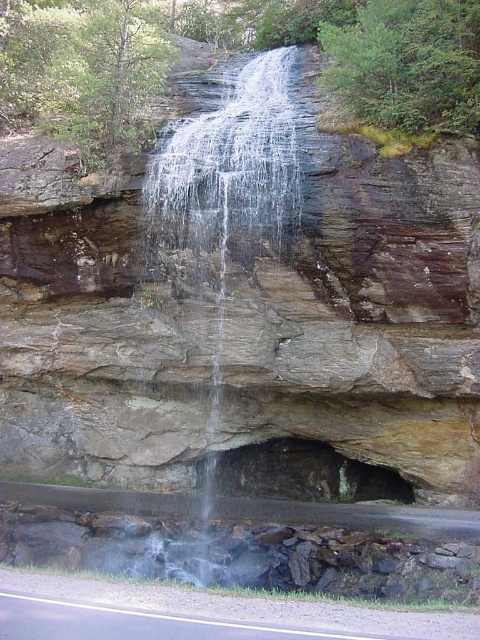
Is point (62, 449) closer to camera compared to point (181, 552)?

No.

Does brown rough rock face at center have a larger size compared to clear water at center?

Correct, brown rough rock face at center is larger in size than clear water at center.

What do you see at coordinates (250, 307) in the screenshot? I see `brown rough rock face at center` at bounding box center [250, 307].

This screenshot has width=480, height=640. Identify the location of brown rough rock face at center. (250, 307).